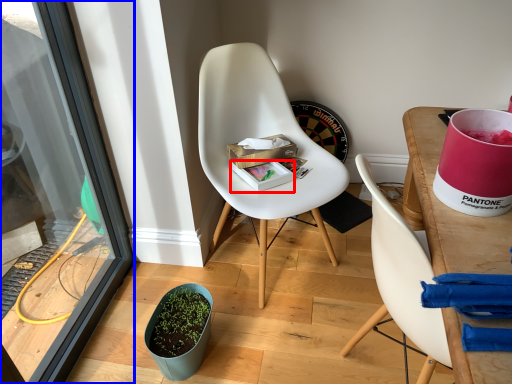
Question: Among these objects, which one is nearest to the camera, box (highlighted by a red box) or screen door (highlighted by a blue box)?

Choices:
 (A) box
 (B) screen door

Answer: (B)